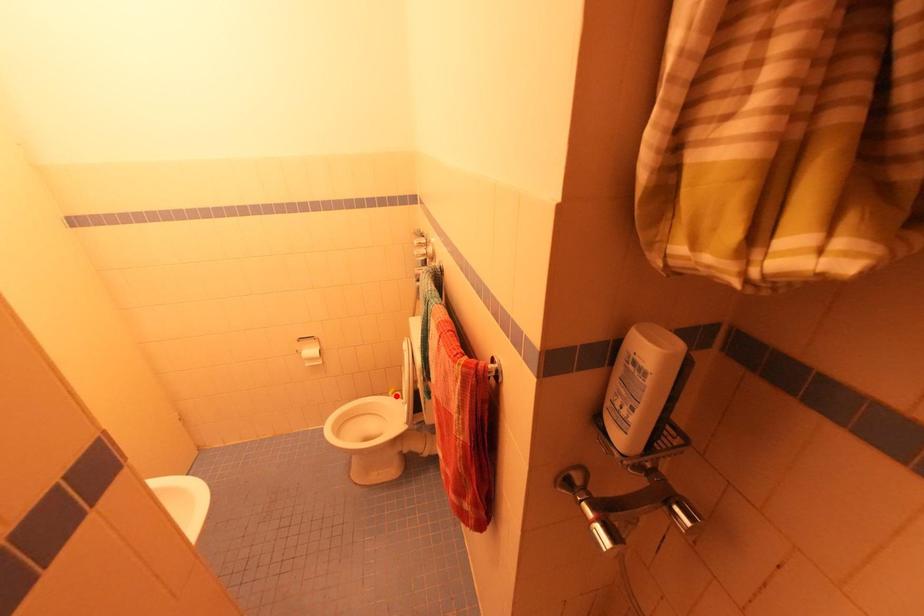
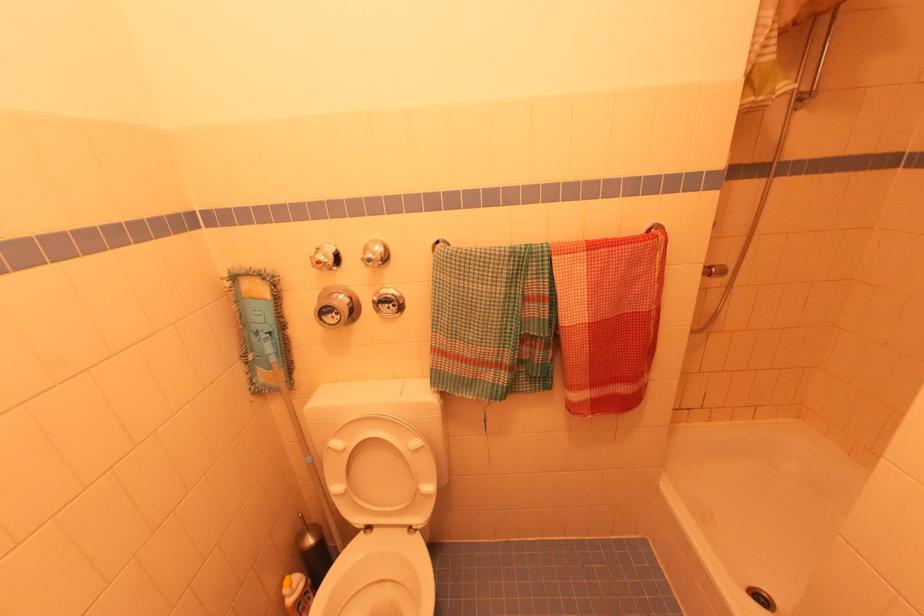
Question: I am providing you with two images of the same scene from different viewpoints. In image1, a red point is highlighted. Considering the same 3D point in image2, which of the following is correct?

Choices:
 (A) It is closer
 (B) It is farther

Answer: (A)